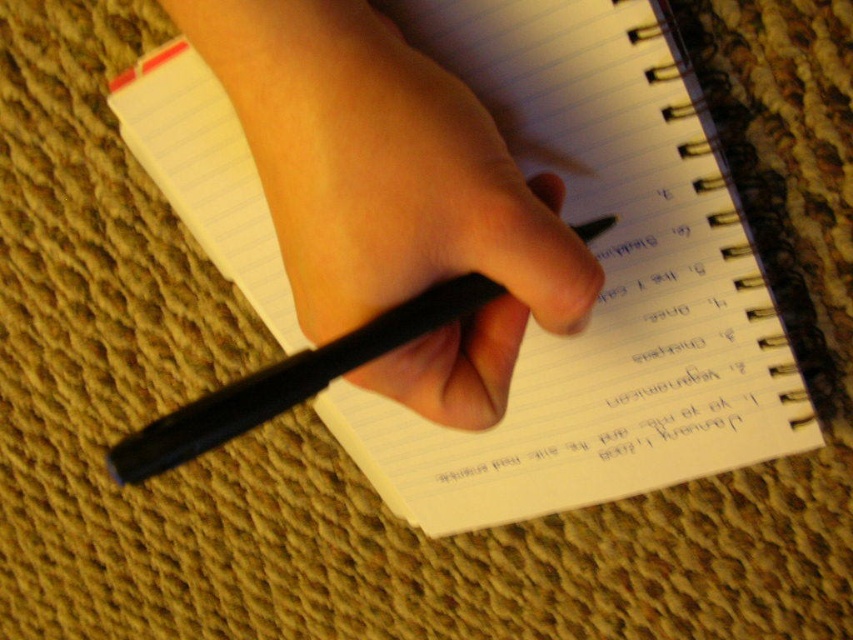
Question: Among these objects, which one is farthest from the camera?

Choices:
 (A) white paper notebook at center
 (B) black matte pencil at center
 (C) black matte pen at center

Answer: (A)

Question: Observing the image, what is the correct spatial positioning of black matte pen at center in reference to black matte pencil at center?

Choices:
 (A) above
 (B) below

Answer: (A)

Question: Which object is the closest to the black matte pen at center?

Choices:
 (A) black matte pencil at center
 (B) white paper notebook at center

Answer: (A)

Question: Considering the relative positions of white paper notebook at center and black matte pencil at center in the image provided, where is white paper notebook at center located with respect to black matte pencil at center?

Choices:
 (A) above
 (B) below

Answer: (A)

Question: Does white paper notebook at center have a lesser width compared to black matte pen at center?

Choices:
 (A) no
 (B) yes

Answer: (A)

Question: Which of the following is the farthest from the observer?

Choices:
 (A) (482, 204)
 (B) (218, 408)
 (C) (740, 234)

Answer: (C)